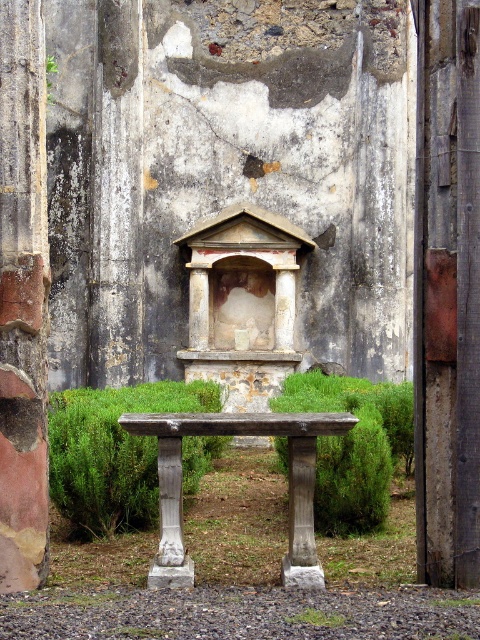
Question: Which point is farther from the camera taking this photo?

Choices:
 (A) (45, 570)
 (B) (204, 412)

Answer: (B)

Question: Is rustic stone column at left above wooden table at center?

Choices:
 (A) no
 (B) yes

Answer: (B)

Question: Can you confirm if rustic stone column at left is positioned above wooden table at center?

Choices:
 (A) no
 (B) yes

Answer: (B)

Question: Is rustic stone column at left thinner than wooden table at center?

Choices:
 (A) no
 (B) yes

Answer: (B)